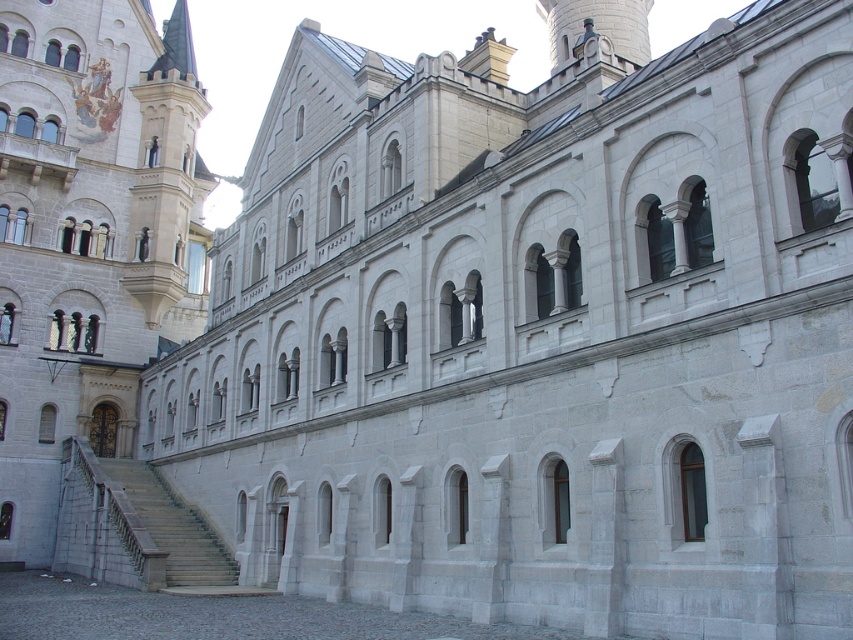
Is light gray stone staircase at lower left below gray stone stairs at lower left?

No.

Who is more forward, (44, 493) or (102, 520)?

Point (102, 520) is in front.

This screenshot has width=853, height=640. What are the coordinates of `light gray stone staircase at lower left` in the screenshot? It's located at (90, 234).